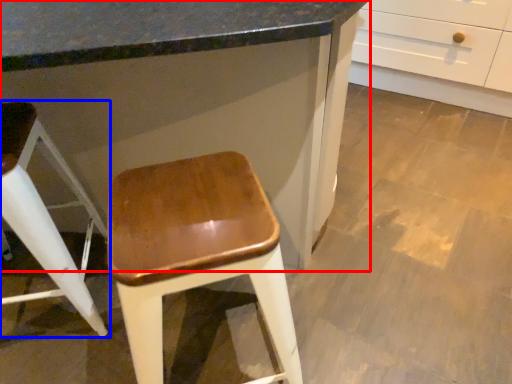
Question: Which object is further to the camera taking this photo, cabinetry (highlighted by a red box) or stool (highlighted by a blue box)?

Choices:
 (A) cabinetry
 (B) stool

Answer: (B)